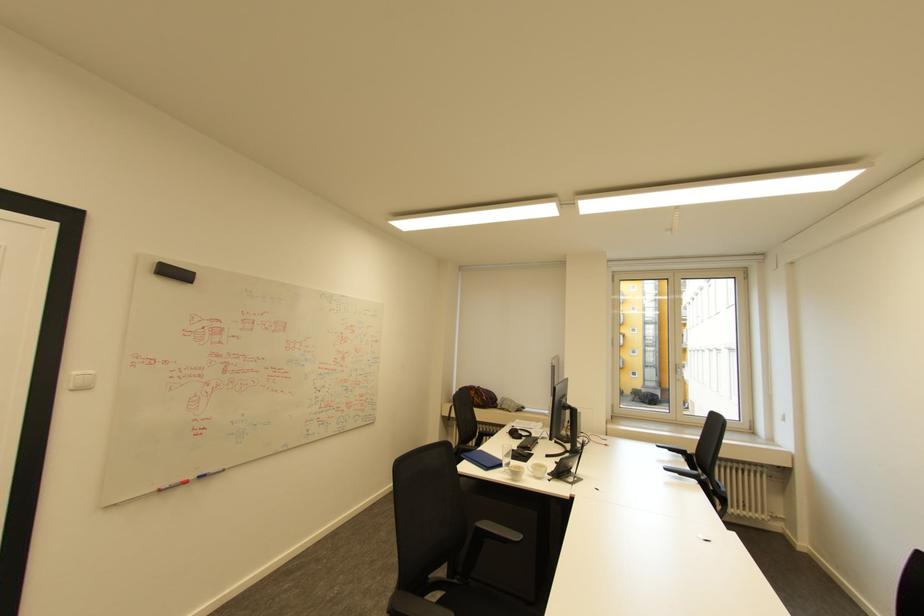
What do you see at coordinates (174, 273) in the screenshot? I see `the black whiteboard eraser` at bounding box center [174, 273].